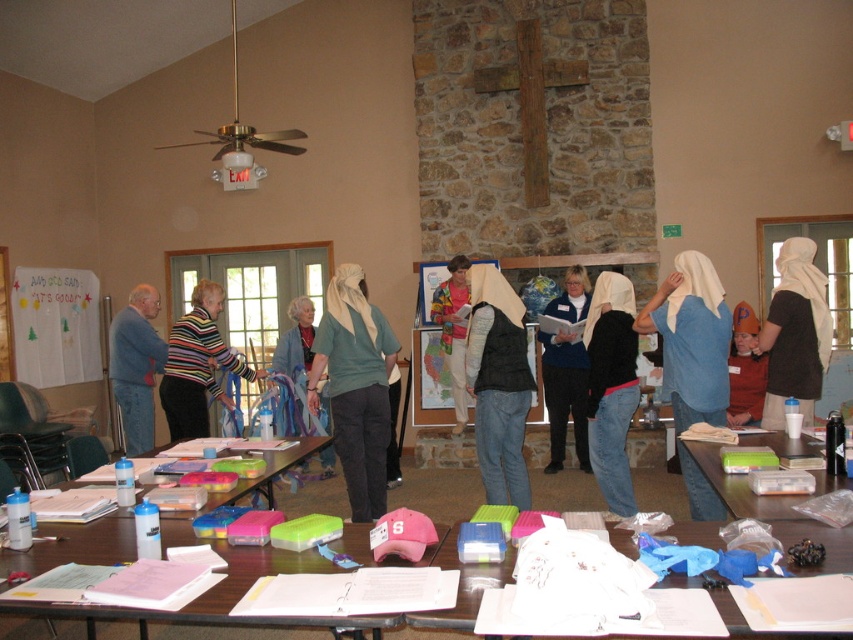
Is black matte vest at center taller than blue denim jacket at left?

Yes, black matte vest at center is taller than blue denim jacket at left.

Find the location of `black matte vest at center`. black matte vest at center is located at coordinates tap(611, 387).

Is point (610, 342) closer to camera compared to point (198, 291)?

That is True.

Is black matte vest at center shorter than striped sweater at center?

In fact, black matte vest at center may be taller than striped sweater at center.

Between point (619, 321) and point (170, 428), which one is positioned behind?

Positioned behind is point (170, 428).

The width and height of the screenshot is (853, 640). I want to click on black matte vest at center, so click(x=611, y=387).

Is beige cotton hijab at center taller than blue fleece vest at center?

No, beige cotton hijab at center is not taller than blue fleece vest at center.

Does beige cotton hijab at center appear over blue fleece vest at center?

Yes.

Locate an element on the screen. The height and width of the screenshot is (640, 853). beige cotton hijab at center is located at coordinates (795, 333).

I want to click on beige cotton hijab at center, so (795, 333).